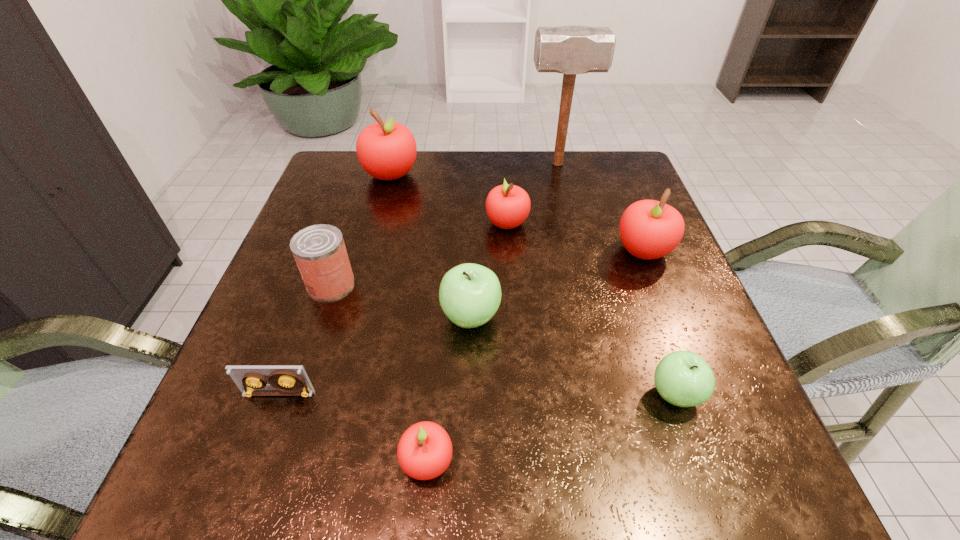
Locate which red apple ranks third in proximity to the third red apple from left to right. Please provide its 2D coordinates. Your answer should be formatted as a tuple, i.e. [(x, y)], where the tuple contains the x and y coordinates of a point satisfying the conditions above.

[(424, 452)]

Locate an element on the screen. The width and height of the screenshot is (960, 540). vacant area in the image that satisfies the following two spatial constraints: 1. on the front side of the second tallest object; 2. on the left side of the third nearest apple is located at coordinates (354, 316).

The image size is (960, 540). I want to click on vacant space that satisfies the following two spatial constraints: 1. on the striking face of the tallest object; 2. at the front of the videotape with visible reels, so click(612, 394).

Identify the location of vacant region that satisfies the following two spatial constraints: 1. on the back side of the farther green apple; 2. on the left side of the nearest object. click(x=440, y=316).